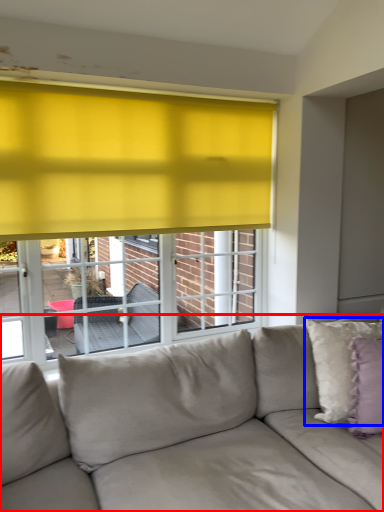
Question: Which object appears closest to the camera in this image, studio couch (highlighted by a red box) or pillow (highlighted by a blue box)?

Choices:
 (A) studio couch
 (B) pillow

Answer: (A)